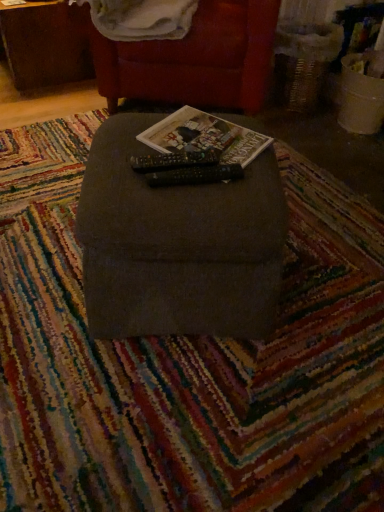
Find the location of `free space in front of dark gray fabric ottoman at center, which appears as the second furniture when viewed from the back`. free space in front of dark gray fabric ottoman at center, which appears as the second furniture when viewed from the back is located at coordinates (182, 414).